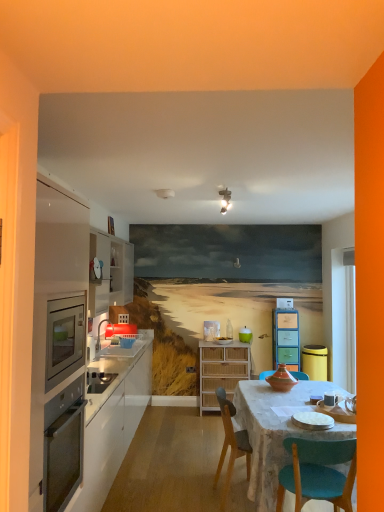
In order to click on free region on the left part of wooden chair at center in this screenshot , I will do `click(187, 496)`.